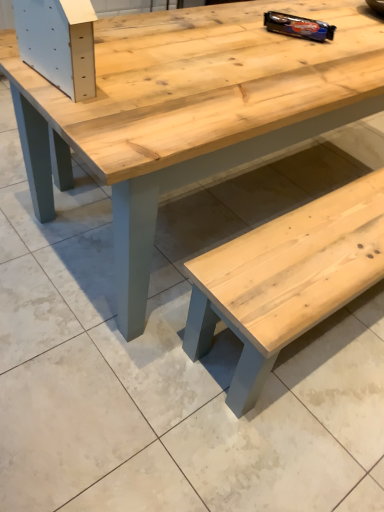
At what (x,y) coordinates should I click in order to perform the action: click on natural wood table at center. Please return your answer as a coordinate pair (x, y). Looking at the image, I should click on (190, 110).

What do you see at coordinates (190, 110) in the screenshot?
I see `natural wood table at center` at bounding box center [190, 110].

The height and width of the screenshot is (512, 384). I want to click on natural wood table at center, so [x=190, y=110].